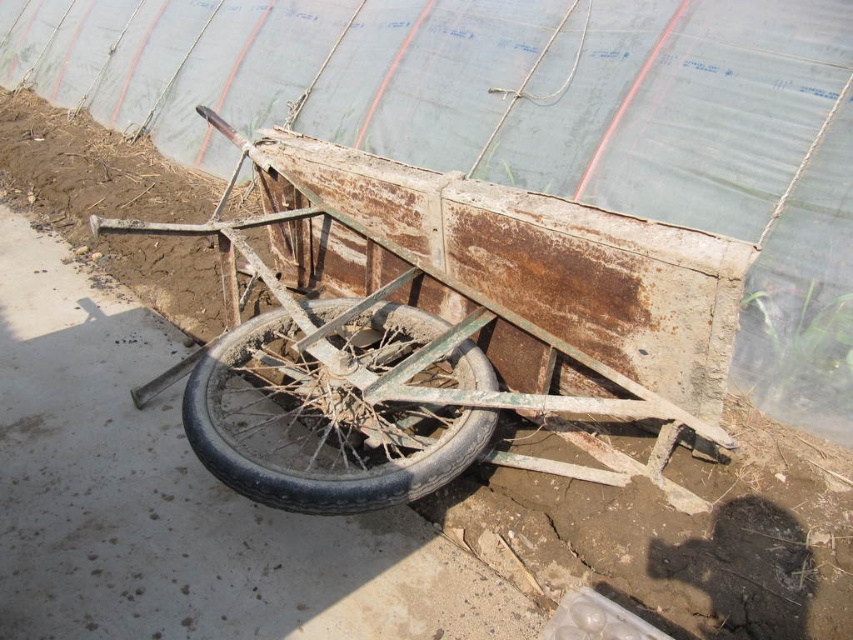
Question: Which point is farther to the camera?

Choices:
 (A) rusty metal cart at center
 (B) rusty metal wheel at lower center

Answer: (B)

Question: Is rusty metal cart at center smaller than rusty metal wheel at lower center?

Choices:
 (A) no
 (B) yes

Answer: (A)

Question: Does rusty metal cart at center have a lesser width compared to rusty metal wheel at lower center?

Choices:
 (A) yes
 (B) no

Answer: (B)

Question: Which point is closer to the camera taking this photo?

Choices:
 (A) (291, 387)
 (B) (276, 205)

Answer: (A)

Question: Does rusty metal cart at center appear on the left side of rusty metal wheel at lower center?

Choices:
 (A) yes
 (B) no

Answer: (B)